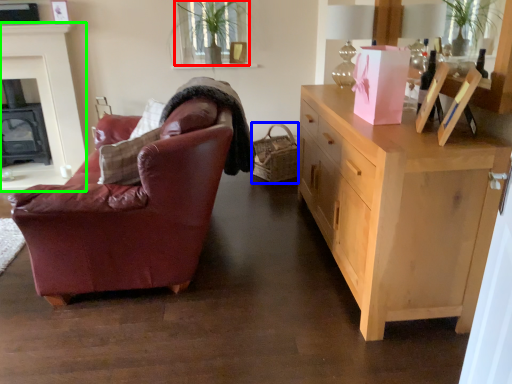
Question: Which object is positioned farthest from plant (highlighted by a red box)? Select from picnic basket (highlighted by a blue box) and fireplace (highlighted by a green box).

Choices:
 (A) picnic basket
 (B) fireplace

Answer: (B)